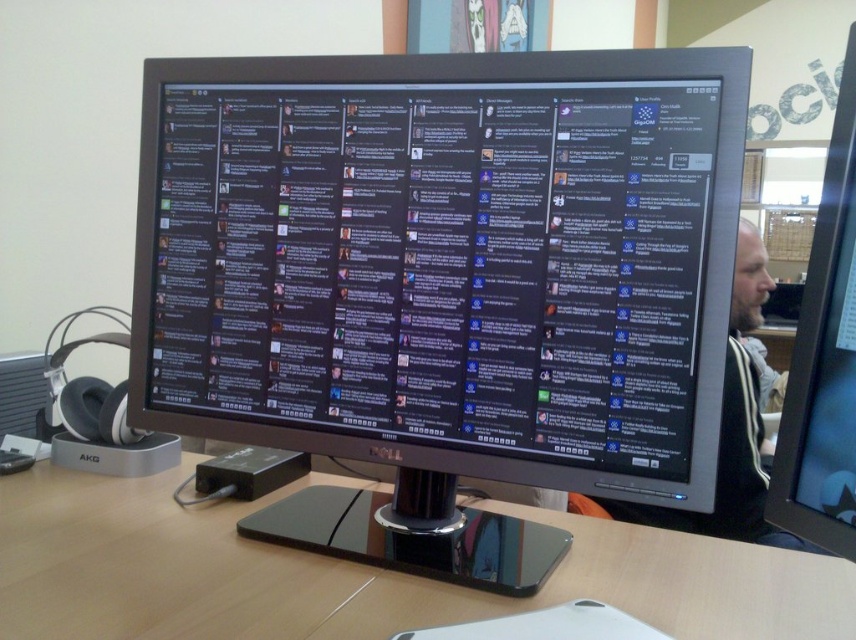
Question: Is black glossy monitor at center above black glossy monitor at right?

Choices:
 (A) yes
 (B) no

Answer: (B)

Question: Observing the image, what is the correct spatial positioning of black glossy monitor at center in reference to wooden table at center?

Choices:
 (A) right
 (B) left

Answer: (A)

Question: Which of the following is the closest to the observer?

Choices:
 (A) (849, 321)
 (B) (284, 243)
 (C) (726, 532)

Answer: (A)

Question: Among these objects, which one is nearest to the camera?

Choices:
 (A) wooden table at center
 (B) black glossy monitor at center
 (C) black glossy monitor at right
 (D) bearded man at right

Answer: (C)

Question: Can you confirm if black glossy monitor at center is positioned to the left of wooden table at center?

Choices:
 (A) yes
 (B) no

Answer: (B)

Question: Which object is positioned closest to the bearded man at right?

Choices:
 (A) black glossy monitor at center
 (B) wooden table at center

Answer: (A)